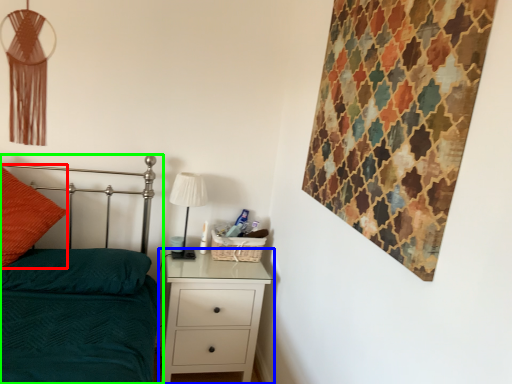
Question: Based on their relative distances, which object is nearer to throw pillow (highlighted by a red box)? Choose from chest of drawers (highlighted by a blue box) and bed (highlighted by a green box).

Choices:
 (A) chest of drawers
 (B) bed

Answer: (B)